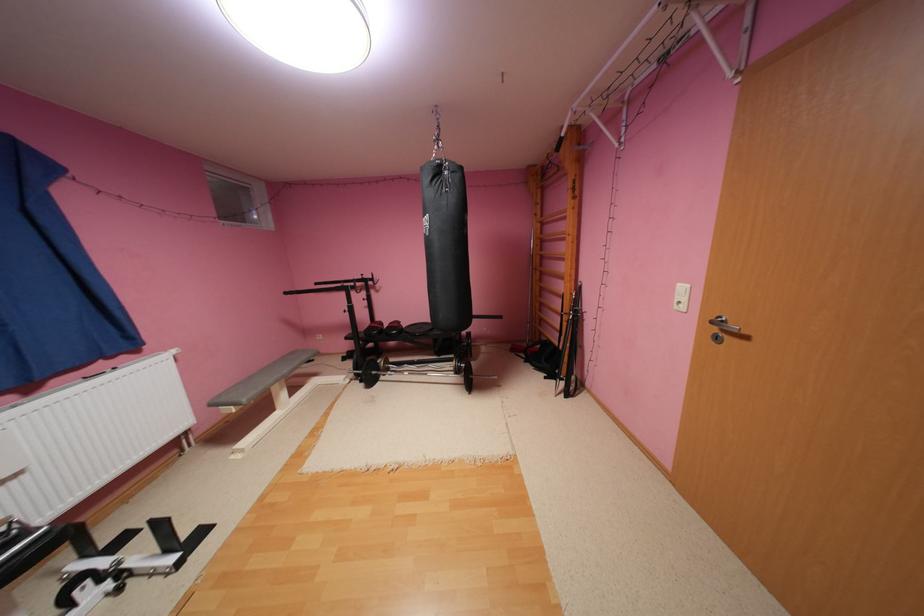
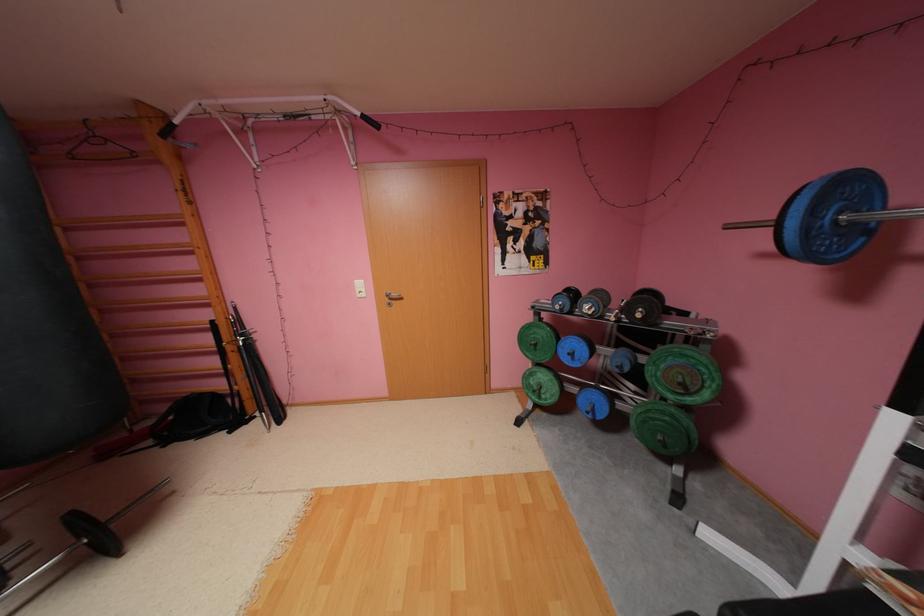
Question: Based on the continuous images, in which direction is the camera rotating? Reply with the corresponding letter.

Choices:
 (A) Left
 (B) Right
 (C) Up
 (D) Down

Answer: (B)